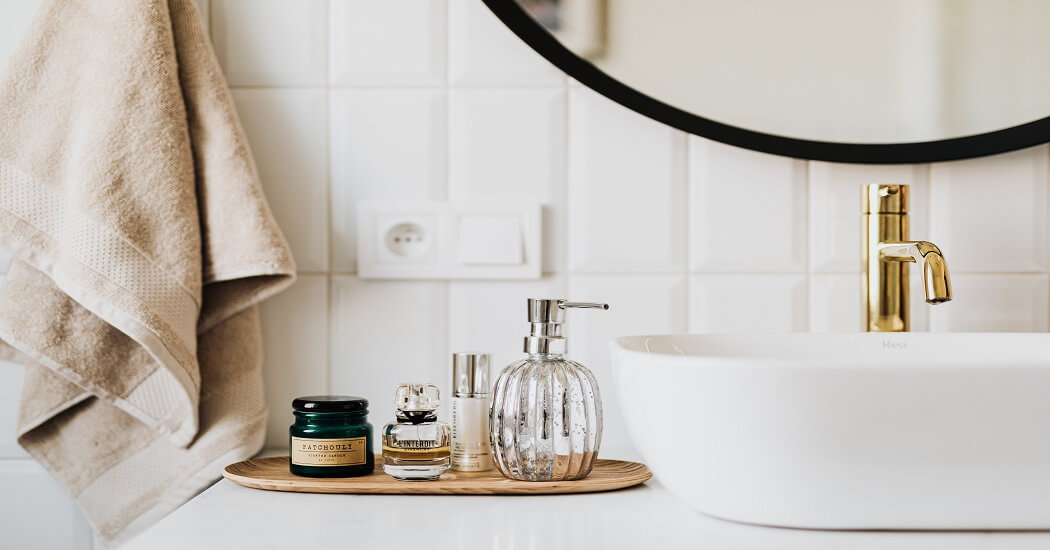
Find the location of a particular element. The image size is (1050, 550). perfume is located at coordinates (427, 430).